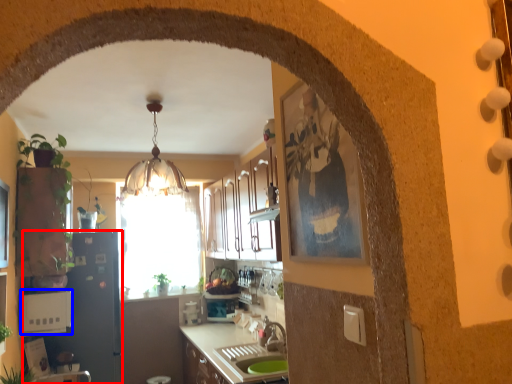
Question: Which object appears closest to the camera in this image, appliance (highlighted by a red box) or appliance (highlighted by a blue box)?

Choices:
 (A) appliance
 (B) appliance

Answer: (B)